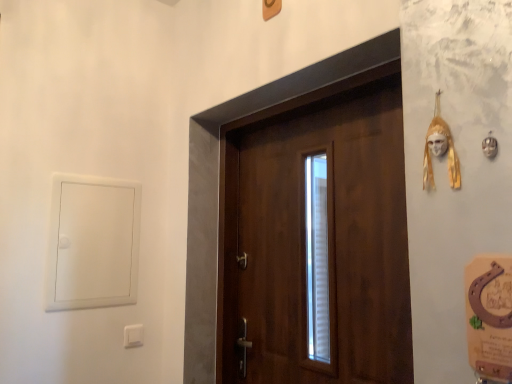
Find the location of a particular element. white plastic light switch at lower left is located at coordinates (133, 335).

The image size is (512, 384). I want to click on wooden door at center, so click(328, 241).

The image size is (512, 384). Identify the location of gold textured mask at upper right. (x=447, y=156).

This screenshot has height=384, width=512. Identify the location of white plastic light switch at lower left. (133, 335).

Is wooden door at center facing towards white plastic light switch at lower left?

No, wooden door at center is not facing towards white plastic light switch at lower left.

Does wooden door at center have a greater height compared to white plastic light switch at lower left?

Yes, wooden door at center is taller than white plastic light switch at lower left.

Considering the relative sizes of wooden door at center and white plastic light switch at lower left in the image provided, is wooden door at center wider than white plastic light switch at lower left?

Correct, the width of wooden door at center exceeds that of white plastic light switch at lower left.

From a real-world perspective, is wooden door at center positioned above or below white plastic light switch at lower left?

Clearly, from a real-world perspective, wooden door at center is above white plastic light switch at lower left.

Is white plastic light switch at lower left turned away from wooden door at center?

white plastic light switch at lower left is not turned away from wooden door at center.

From a real-world perspective, is white plastic light switch at lower left physically below wooden door at center?

Yes, from a real-world perspective, white plastic light switch at lower left is beneath wooden door at center.

Which point is more forward, (140, 333) or (361, 145)?

Point (361, 145)

From the image's perspective, which one is positioned higher, white plastic light switch at lower left or wooden door at center?

wooden door at center.

Considering the sizes of objects wooden door at center and gold textured mask at upper right in the image provided, who is taller, wooden door at center or gold textured mask at upper right?

wooden door at center.

Which is in front, point (302, 241) or point (451, 135)?

The point (451, 135) is closer.

From a real-world perspective, between wooden door at center and gold textured mask at upper right, who is vertically higher?

gold textured mask at upper right is physically above.

How many degrees apart are the facing directions of white plastic window at left and wooden door at center?

They differ by 89.1 degrees in their facing directions.

Is white plastic window at left aimed at wooden door at center?

No, white plastic window at left is not facing towards wooden door at center.

Is white plastic window at left far away from wooden door at center?

No, there isn't a large distance between white plastic window at left and wooden door at center.

From their relative heights in the image, would you say white plastic window at left is taller or shorter than wooden door at center?

white plastic window at left is shorter than wooden door at center.

Does white plastic window at left have a greater height compared to gold textured mask at upper right?

Correct, white plastic window at left is much taller as gold textured mask at upper right.

Considering the relative sizes of white plastic window at left and gold textured mask at upper right in the image provided, is white plastic window at left smaller than gold textured mask at upper right?

No, white plastic window at left is not smaller than gold textured mask at upper right.

Is white plastic window at left far from gold textured mask at upper right?

Yes, white plastic window at left and gold textured mask at upper right are quite far apart.

Is wooden door at center bigger or smaller than white plastic window at left?

Clearly, wooden door at center is larger in size than white plastic window at left.

From the picture: Considering the positions of objects wooden door at center and white plastic window at left in the image provided, who is more to the right, wooden door at center or white plastic window at left?

wooden door at center.

Between wooden door at center and white plastic window at left, which one has smaller width?

white plastic window at left is thinner.

From a real-world perspective, is wooden door at center physically located above or below white plastic window at left?

Clearly, from a real-world perspective, wooden door at center is below white plastic window at left.

Is gold textured mask at upper right positioned with its back to wooden door at center?

That's not correct — gold textured mask at upper right is not looking away from wooden door at center.

Is gold textured mask at upper right to the right of wooden door at center from the viewer's perspective?

Yes, gold textured mask at upper right is to the right of wooden door at center.

What's the angular difference between gold textured mask at upper right and wooden door at center's facing directions?

0.203 degrees.

Which of these two, gold textured mask at upper right or wooden door at center, stands taller?

Standing taller between the two is wooden door at center.

In the image, there is a wooden door at center. Find the location of `light switch below it (from the image's perspective)`. light switch below it (from the image's perspective) is located at coordinates pos(133,335).

Where is `door on the right of the white plastic light switch at lower left`? The image size is (512, 384). door on the right of the white plastic light switch at lower left is located at coordinates (328, 241).

Estimate the real-world distances between objects in this image. Which object is further from wooden door at center, white plastic light switch at lower left or white plastic window at left?

The object further to wooden door at center is white plastic light switch at lower left.

Which object lies nearer to the anchor point gold textured mask at upper right, white plastic window at left or white plastic light switch at lower left?

The object closer to gold textured mask at upper right is white plastic window at left.

From the picture: Based on their spatial positions, is white plastic light switch at lower left or gold textured mask at upper right closer to wooden door at center?

gold textured mask at upper right.

Based on their spatial positions, is gold textured mask at upper right or wooden door at center closer to white plastic window at left?

wooden door at center is positioned closer to the anchor white plastic window at left.

Which object lies nearer to the anchor point white plastic light switch at lower left, white plastic window at left or gold textured mask at upper right?

Based on the image, white plastic window at left appears to be nearer to white plastic light switch at lower left.

Considering their positions, is gold textured mask at upper right positioned further to wooden door at center than white plastic window at left?

A: gold textured mask at upper right.

Which object lies nearer to the anchor point white plastic window at left, gold textured mask at upper right or white plastic light switch at lower left?

white plastic light switch at lower left.

Which object lies nearer to the anchor point white plastic window at left, white plastic light switch at lower left or gold textured mask at upper right?

The object closer to white plastic window at left is white plastic light switch at lower left.

The height and width of the screenshot is (384, 512). I want to click on light switch located between white plastic window at left and gold textured mask at upper right in the left-right direction, so click(x=133, y=335).

Identify the location of light switch located between white plastic window at left and wooden door at center in the left-right direction. (133, 335).

Find the location of a particular element. The width and height of the screenshot is (512, 384). door situated between white plastic light switch at lower left and gold textured mask at upper right from left to right is located at coordinates (328, 241).

This screenshot has height=384, width=512. I want to click on door located between white plastic window at left and gold textured mask at upper right in the left-right direction, so click(x=328, y=241).